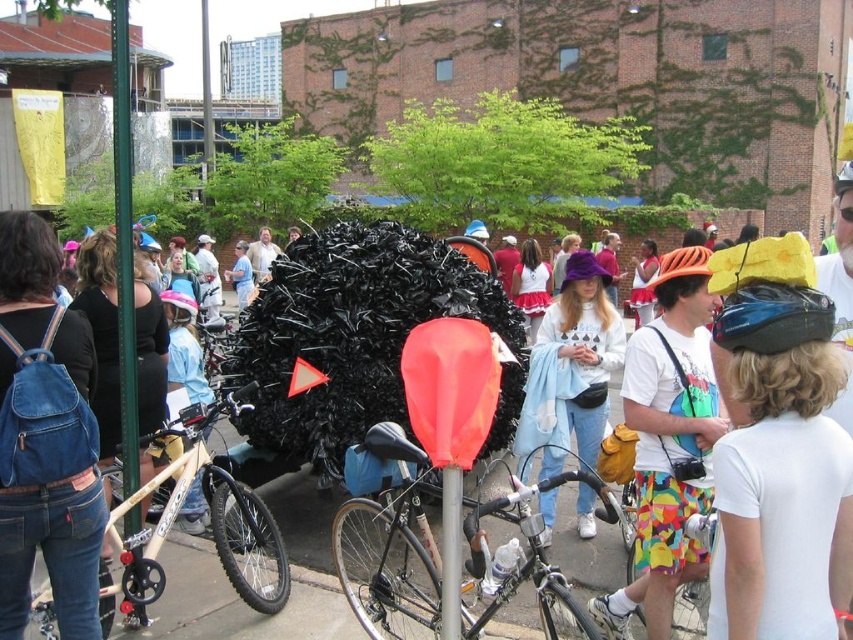
You are a photographer setting up a tripod to capture the scene. You want to ensure both the light blue denim jeans at center and the black matte bicycle at center are in focus. Which object should you adjust the focus on first to ensure proper depth of field?

The light blue denim jeans at center is much taller than the black matte bicycle at center, so you should focus on the taller object first to ensure proper depth of field.

You are a delivery person who needs to pick up a package from the blue matte helmet at upper right and deliver it to the black matte bicycle at center. Given that your delivery drone has a maximum range of 50 feet, will it be able to complete the delivery without needing to recharge?

The distance between the blue matte helmet at upper right and the black matte bicycle at center is 45.26 feet. Since the drone can travel up to 50 feet, it can complete the delivery without needing to recharge.

You are a photographer standing at the center of the scene. You see the multicolored fabric shorts at center and the wooden frame bicycle at left. Which object is higher from the ground?

The multicolored fabric shorts at center is above wooden frame bicycle at left, so the multicolored fabric shorts at center is higher from the ground.